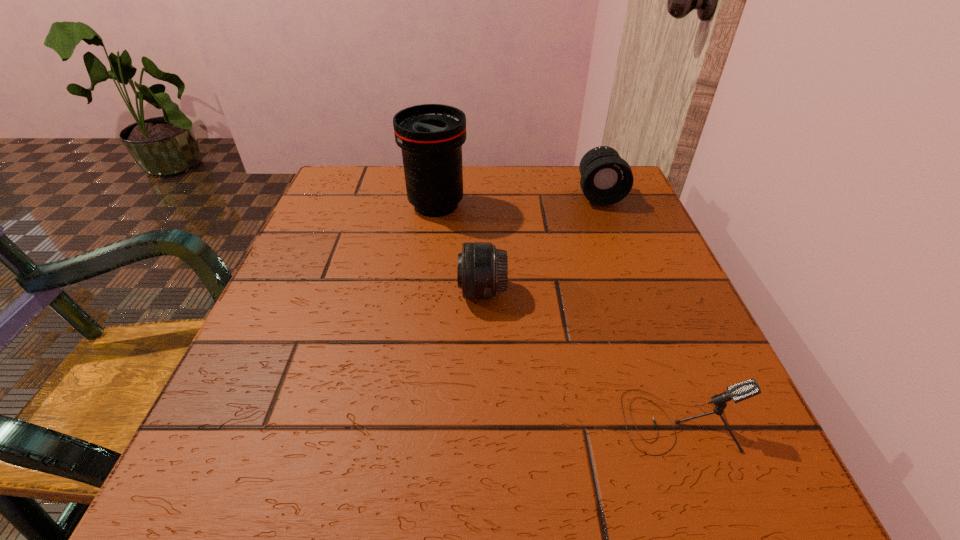
You are a GUI agent. You are given a task and a screenshot of the screen. Output one action in this format:
    pyautogui.click(x=<x>, y=<y>)
    Task: Click on the vacant region located on the stand of the nearest object
    
    Given the screenshot: What is the action you would take?
    pyautogui.click(x=391, y=421)

Find the location of `vacant region located on the stand of the nearest object`. vacant region located on the stand of the nearest object is located at coordinates (581, 421).

At what (x,y) coordinates should I click in order to perform the action: click on object at the near edge. Please return your answer as a coordinate pair (x, y). This screenshot has height=540, width=960. Looking at the image, I should click on (738, 392).

Image resolution: width=960 pixels, height=540 pixels. What are the coordinates of `telephoto lens that is at the right edge` in the screenshot? It's located at (606, 179).

This screenshot has width=960, height=540. What are the coordinates of `microphone present at the right edge` in the screenshot? It's located at (738, 392).

Where is `object that is positioned at the far right corner`? Image resolution: width=960 pixels, height=540 pixels. object that is positioned at the far right corner is located at coordinates point(606,179).

At what (x,y) coordinates should I click in order to perform the action: click on object positioned at the near right corner. Please return your answer as a coordinate pair (x, y). Looking at the image, I should click on (738, 392).

Locate an element on the screen. The image size is (960, 540). free location at the far edge is located at coordinates (540, 184).

Where is `free space at the near edge`? free space at the near edge is located at coordinates click(x=603, y=453).

Identify the location of vacant space at the left edge of the desktop. (307, 299).